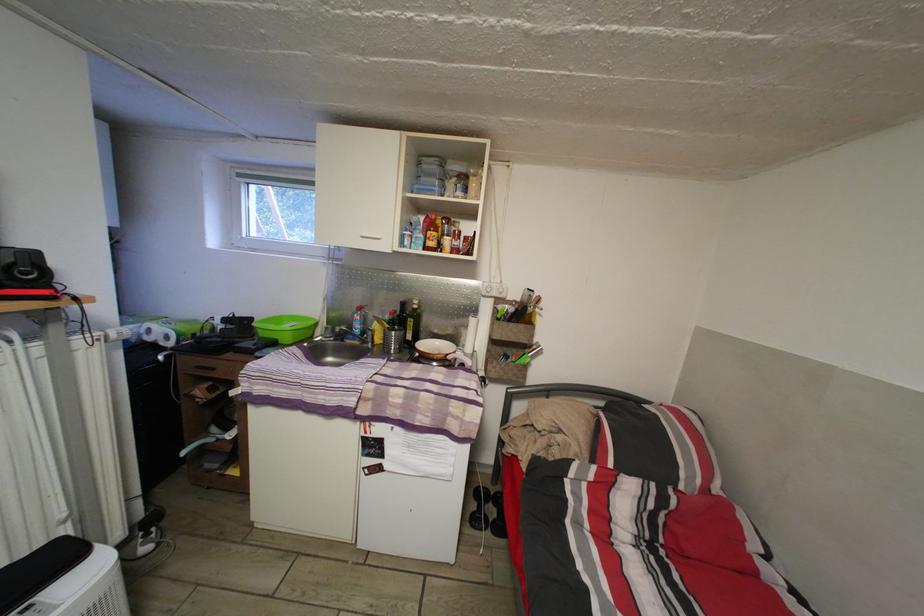
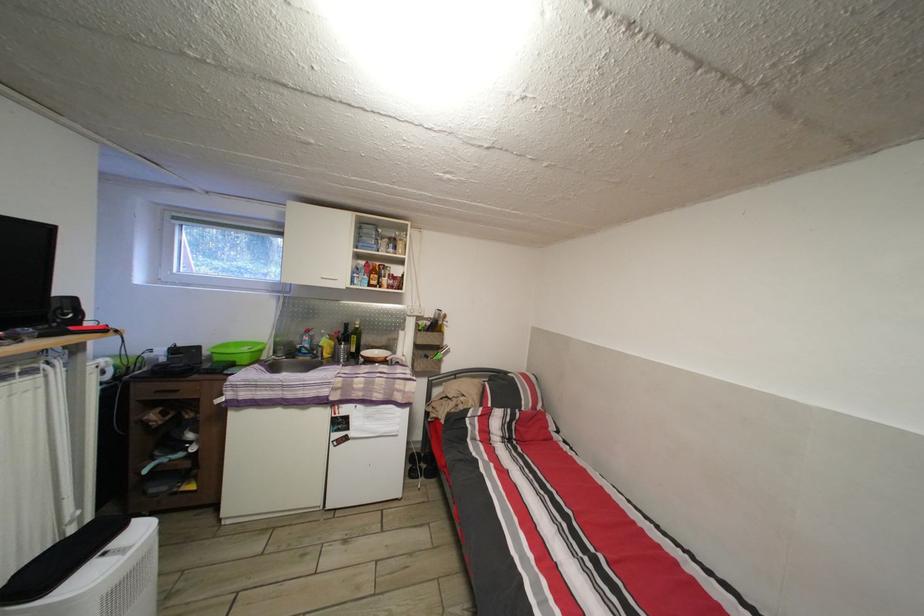
Find the pixel in the second image that matches the point at 220,376 in the first image.

(184, 398)